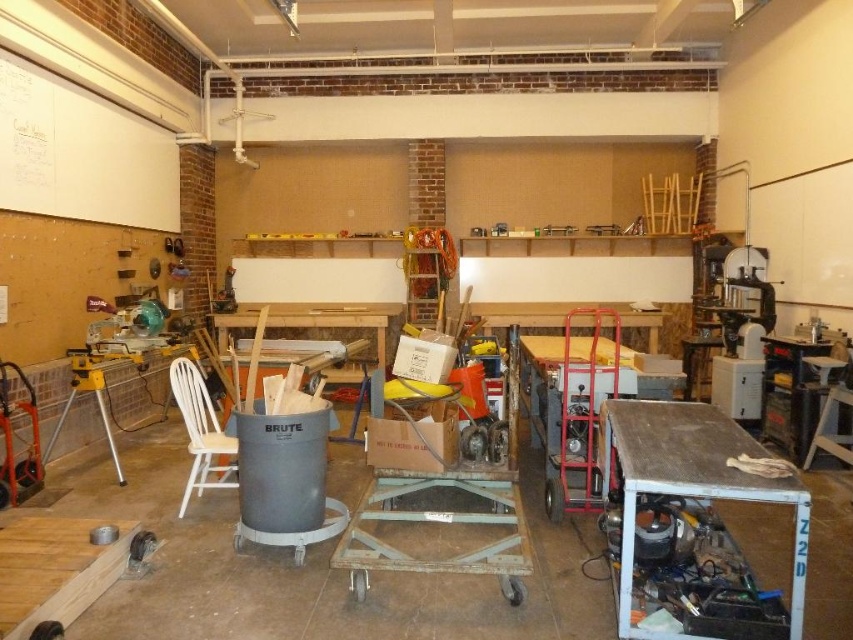
Question: Which point is closer to the camera?

Choices:
 (A) wooden workbench at lower right
 (B) white wood chair at left
 (C) white matte bulletin board at upper left

Answer: (A)

Question: Can you confirm if white matte bulletin board at upper left is thinner than white wood chair at left?

Choices:
 (A) yes
 (B) no

Answer: (A)

Question: Based on their relative distances, which object is farther from the white matte bulletin board at upper left?

Choices:
 (A) wooden workbench at lower right
 (B) white wood chair at left

Answer: (A)

Question: Can you confirm if wooden workbench at lower right is positioned below white wood chair at left?

Choices:
 (A) yes
 (B) no

Answer: (B)

Question: Which of the following is the farthest from the observer?

Choices:
 (A) white wood chair at left
 (B) white matte bulletin board at upper left
 (C) wooden workbench at lower right

Answer: (B)

Question: Is wooden workbench at lower right smaller than white wood chair at left?

Choices:
 (A) yes
 (B) no

Answer: (A)